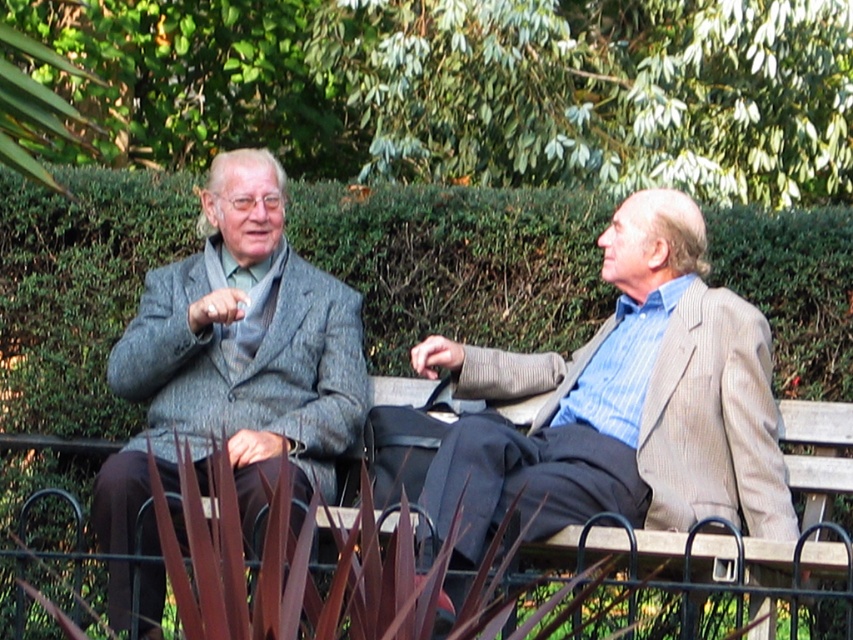
Question: Can you confirm if light brown textured suit at right is positioned to the left of wooden bench at center?

Choices:
 (A) yes
 (B) no

Answer: (A)

Question: Among these points, which one is nearest to the camera?

Choices:
 (A) (117, 380)
 (B) (254, 173)
 (C) (820, 518)
 (D) (746, 314)

Answer: (D)

Question: Is light brown textured suit at right above wooden bench at center?

Choices:
 (A) yes
 (B) no

Answer: (A)

Question: Is gray woolen suit at center smaller than gray woolen suit at left?

Choices:
 (A) no
 (B) yes

Answer: (A)

Question: Which point is farther to the camera?

Choices:
 (A) gray woolen suit at left
 (B) wooden bench at center
 (C) gray woolen suit at center
 (D) light brown textured suit at right

Answer: (A)

Question: Which point appears farthest from the camera in this image?

Choices:
 (A) pyautogui.click(x=334, y=362)
 (B) pyautogui.click(x=650, y=502)

Answer: (A)